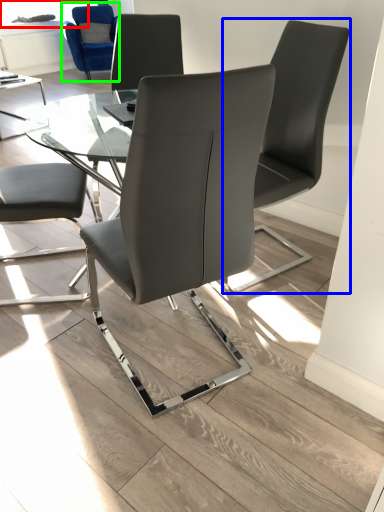
Question: Which is nearer to the window screen (highlighted by a red box)? chair (highlighted by a blue box) or chair (highlighted by a green box).

Choices:
 (A) chair
 (B) chair

Answer: (B)